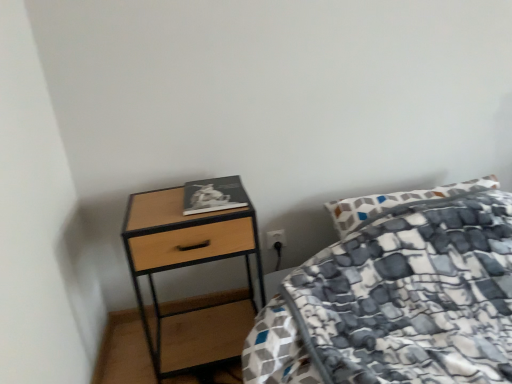
Locate an element on the screen. vacant point above woodenmaterial/texturenightstand at left (from a real-world perspective) is located at coordinates (180, 203).